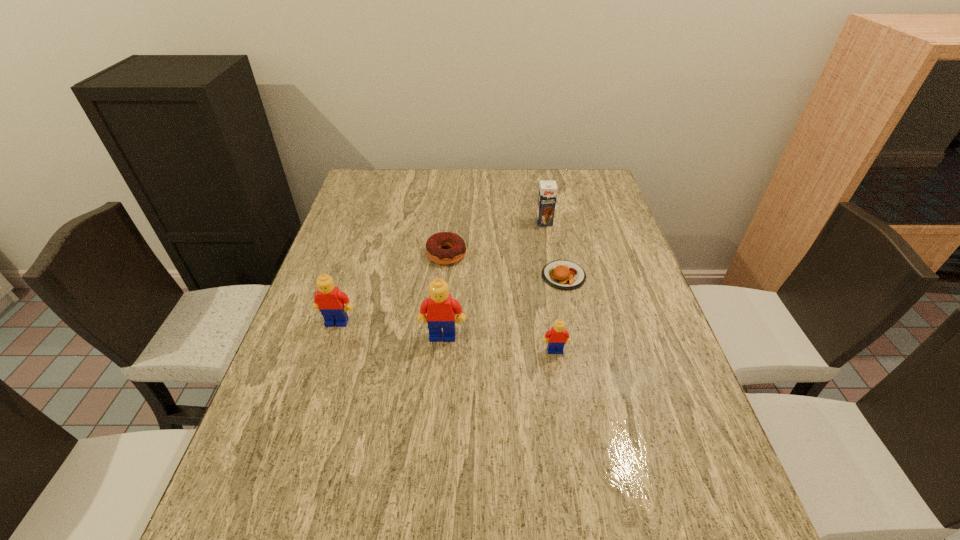
Locate an element on the screen. vacant spot to place a Lego on the right is located at coordinates (675, 366).